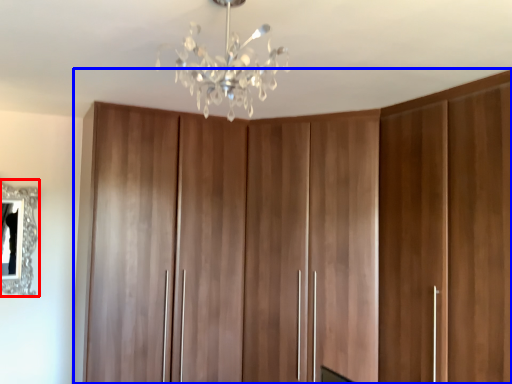
Question: Which object appears farthest to the camera in this image, mirror (highlighted by a red box) or cupboard (highlighted by a blue box)?

Choices:
 (A) mirror
 (B) cupboard

Answer: (A)